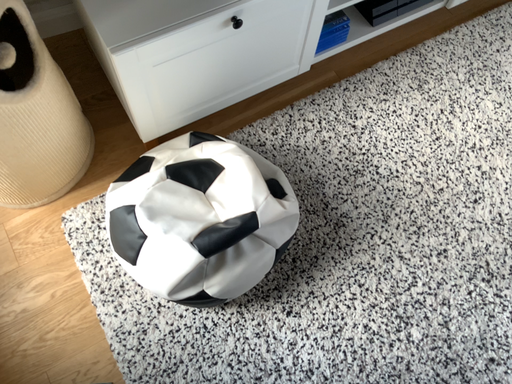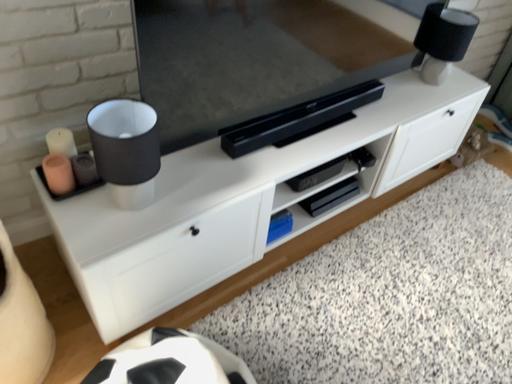
Question: How did the camera likely rotate when shooting the video?

Choices:
 (A) rotated upward
 (B) rotated downward

Answer: (A)